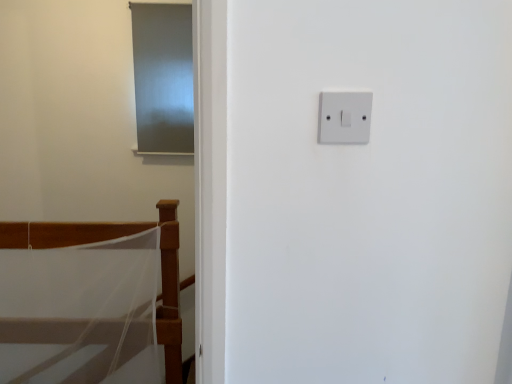
Identify the location of white plastic light switch at upper right. This screenshot has width=512, height=384. (344, 117).

Does white plastic light switch at upper right have a larger size compared to white mesh bed at lower left?

Actually, white plastic light switch at upper right might be smaller than white mesh bed at lower left.

Can you tell me how much white plastic light switch at upper right and white mesh bed at lower left differ in facing direction?

The facing directions of white plastic light switch at upper right and white mesh bed at lower left are 0.301 degrees apart.

In the image, is white plastic light switch at upper right positioned in front of or behind white mesh bed at lower left?

Visually, white plastic light switch at upper right is located in front of white mesh bed at lower left.

Considering the points (362, 143) and (150, 75), which point is in front, point (362, 143) or point (150, 75)?

The point (362, 143) is in front.

Is white plastic light switch at upper right inside or outside of matte gray screen door at upper left?

white plastic light switch at upper right is outside matte gray screen door at upper left.

Is matte gray screen door at upper left at the back of white plastic light switch at upper right?

That's right, white plastic light switch at upper right is facing away from matte gray screen door at upper left.

Considering the relative sizes of white plastic light switch at upper right and matte gray screen door at upper left in the image provided, is white plastic light switch at upper right taller than matte gray screen door at upper left?

No.

Is point (141, 16) in front of point (370, 116)?

That is False.

Does matte gray screen door at upper left have a lesser height compared to white plastic light switch at upper right?

In fact, matte gray screen door at upper left may be taller than white plastic light switch at upper right.

From the image's perspective, which object appears higher, matte gray screen door at upper left or white plastic light switch at upper right?

matte gray screen door at upper left.

Is matte gray screen door at upper left spatially inside white plastic light switch at upper right, or outside of it?

matte gray screen door at upper left exists outside the volume of white plastic light switch at upper right.

Can you confirm if white mesh bed at lower left is positioned to the left of matte gray screen door at upper left?

Indeed, white mesh bed at lower left is positioned on the left side of matte gray screen door at upper left.

From a real-world perspective, is white mesh bed at lower left above or below matte gray screen door at upper left?

Clearly, from a real-world perspective, white mesh bed at lower left is below matte gray screen door at upper left.

Would you say white mesh bed at lower left contains matte gray screen door at upper left?

No, matte gray screen door at upper left is located outside of white mesh bed at lower left.

Considering the relative sizes of white mesh bed at lower left and white plastic light switch at upper right in the image provided, is white mesh bed at lower left wider than white plastic light switch at upper right?

Indeed, white mesh bed at lower left has a greater width compared to white plastic light switch at upper right.

How different are the orientations of white mesh bed at lower left and white plastic light switch at upper right in degrees?

They differ by 0.301 degrees in their facing directions.

Between point (181, 376) and point (353, 126), which one is positioned behind?

Point (181, 376)

Is white mesh bed at lower left at the right side of white plastic light switch at upper right?

Incorrect, white mesh bed at lower left is not on the right side of white plastic light switch at upper right.

Which of these two, matte gray screen door at upper left or white mesh bed at lower left, is smaller?

With smaller size is matte gray screen door at upper left.

Is the position of matte gray screen door at upper left more distant than that of white mesh bed at lower left?

Yes, it is.

Which point is more forward, (150,102) or (109,237)?

The point (109,237) is more forward.

Locate an element on the screen. light switch on the right of white mesh bed at lower left is located at coordinates (344, 117).

This screenshot has width=512, height=384. Identify the location of light switch that appears below the matte gray screen door at upper left (from the image's perspective). (344, 117).

Estimate the real-world distances between objects in this image. Which object is closer to white mesh bed at lower left, matte gray screen door at upper left or white plastic light switch at upper right?

Among the two, matte gray screen door at upper left is located nearer to white mesh bed at lower left.

Based on their spatial positions, is white mesh bed at lower left or matte gray screen door at upper left closer to white plastic light switch at upper right?

white mesh bed at lower left is closer to white plastic light switch at upper right.

Which object lies nearer to the anchor point white plastic light switch at upper right, matte gray screen door at upper left or white mesh bed at lower left?

white mesh bed at lower left.

When comparing their distances from matte gray screen door at upper left, does white plastic light switch at upper right or white mesh bed at lower left seem closer?

white mesh bed at lower left.

Which object lies further to the anchor point matte gray screen door at upper left, white mesh bed at lower left or white plastic light switch at upper right?

white plastic light switch at upper right.

From the picture: Based on their spatial positions, is white plastic light switch at upper right or matte gray screen door at upper left further from white mesh bed at lower left?

white plastic light switch at upper right is further to white mesh bed at lower left.

Where is `furniture positioned between white plastic light switch at upper right and matte gray screen door at upper left from near to far`? This screenshot has width=512, height=384. furniture positioned between white plastic light switch at upper right and matte gray screen door at upper left from near to far is located at coordinates (114, 238).